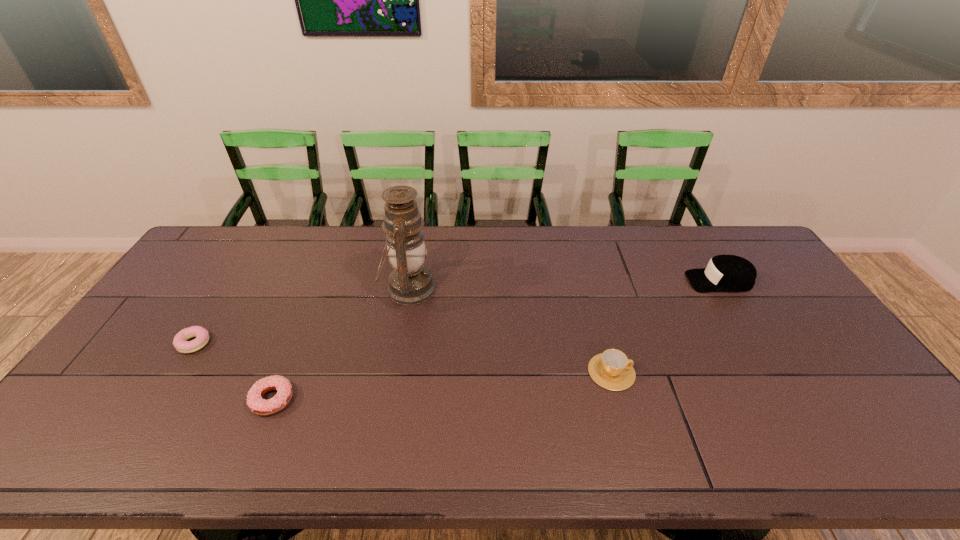
Locate an element on the screen. Image resolution: width=960 pixels, height=540 pixels. free space located 0.200m on the front of the third object from left to right is located at coordinates (395, 369).

Identify the location of blank area located 0.140m on the front-facing side of the second tallest object. The image size is (960, 540). (644, 281).

Where is `free space located on the front-facing side of the second tallest object`? This screenshot has width=960, height=540. free space located on the front-facing side of the second tallest object is located at coordinates (641, 281).

Locate an element on the screen. The image size is (960, 540). free space located on the front-facing side of the second tallest object is located at coordinates (571, 281).

At what (x,y) coordinates should I click in order to perform the action: click on vacant space located with the handle on the side of the cup. Please return your answer as a coordinate pair (x, y). Looking at the image, I should click on (762, 372).

Image resolution: width=960 pixels, height=540 pixels. I want to click on free space located on the left of the fourth object from right to left, so click(120, 400).

Identify the location of free space located 0.120m on the front of the left doughnut. (163, 393).

Locate an element on the screen. This screenshot has height=540, width=960. object at the far edge is located at coordinates (410, 282).

The width and height of the screenshot is (960, 540). Identify the location of object that is at the left edge. (180, 342).

Locate an element on the screen. Image resolution: width=960 pixels, height=540 pixels. object situated at the right edge is located at coordinates (729, 273).